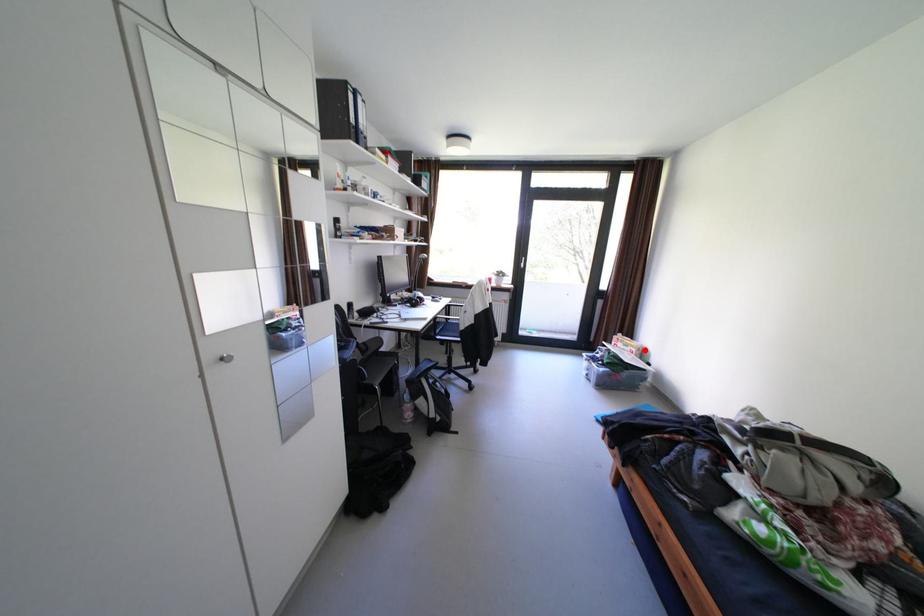
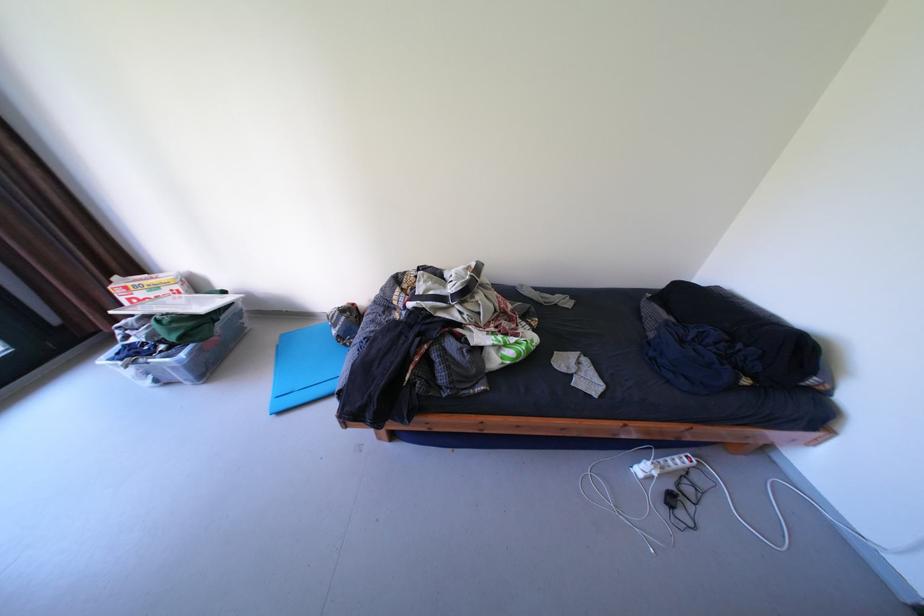
Where in the second image is the point corresponding to the highlighted location from the first image?

(188, 286)